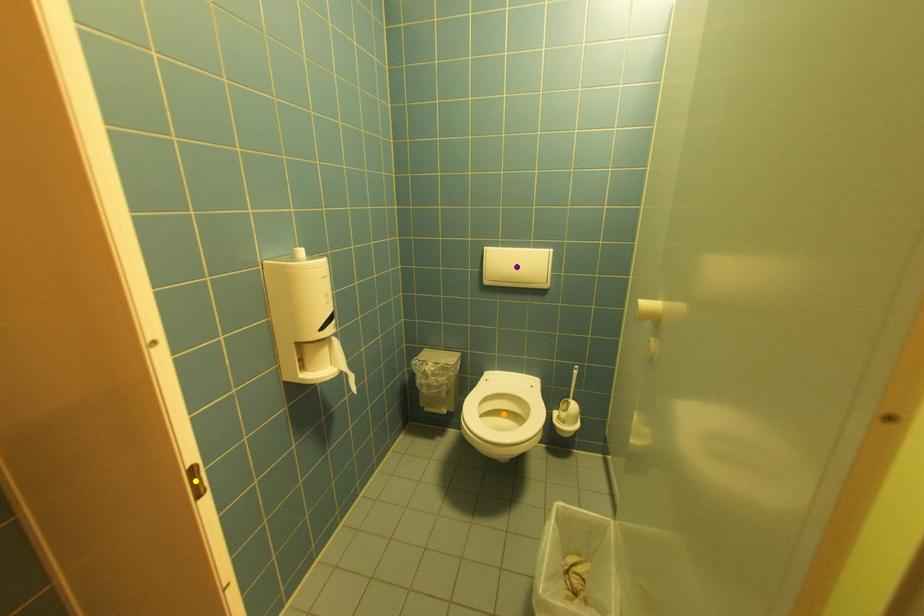
Order these from nearest to farthest:
1. purple point
2. orange point
3. yellow point

orange point < purple point < yellow point